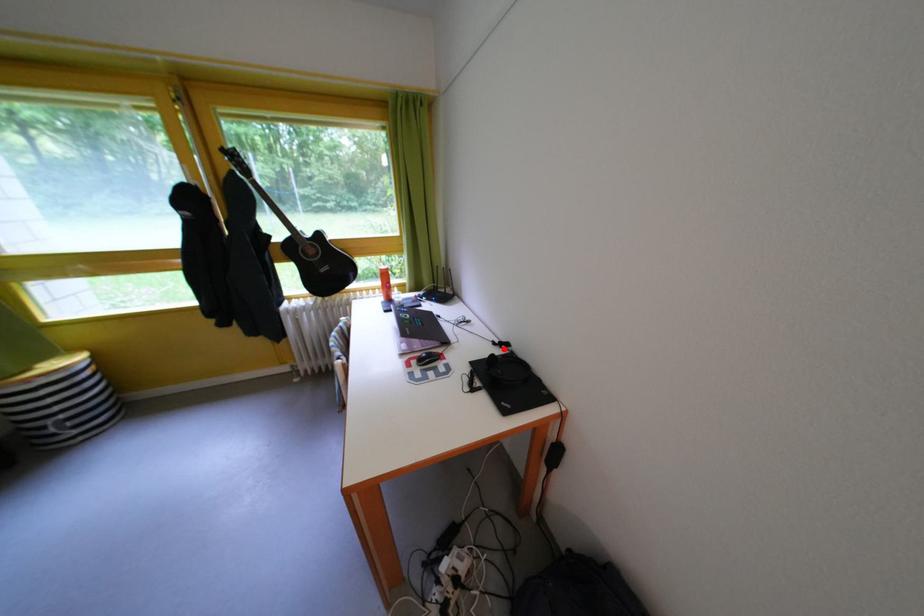
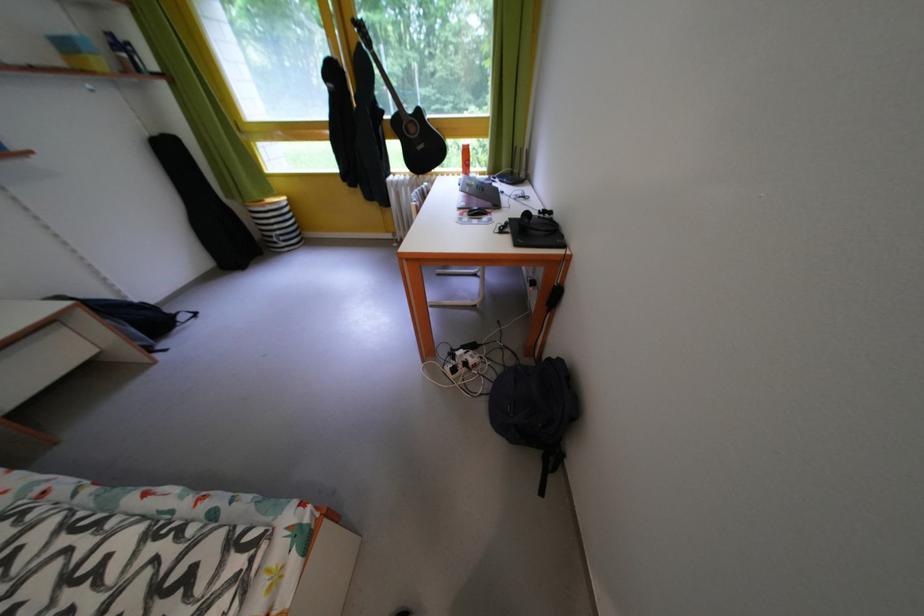
In the second image, find the point that corresponds to the highlighted location in the first image.

(550, 217)